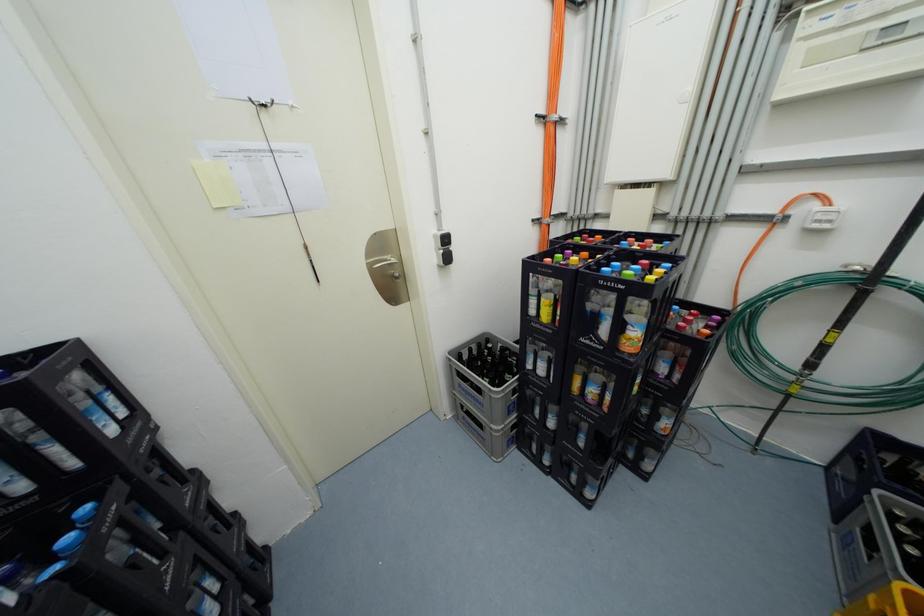
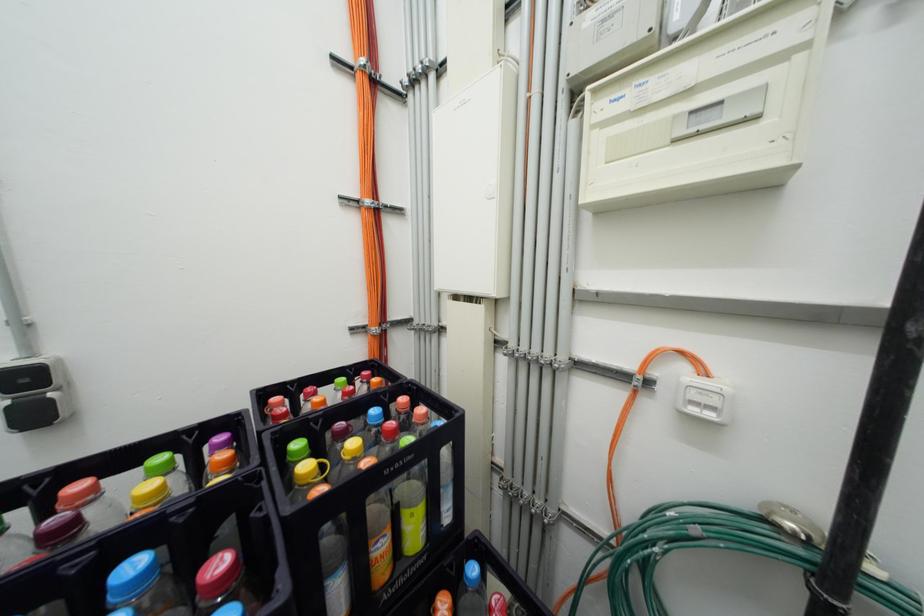
Question: The images are taken continuously from a first-person perspective. In which direction is your viewpoint rotating?

Choices:
 (A) Left
 (B) Right
 (C) Up
 (D) Down

Answer: (C)